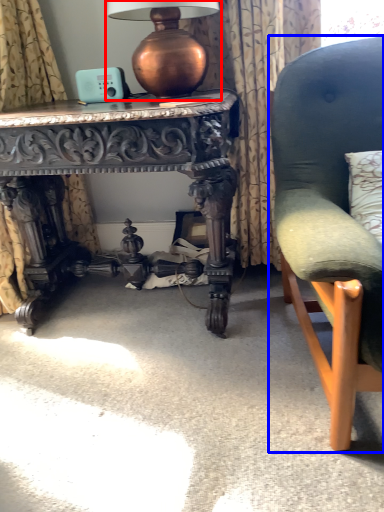
Question: Which object appears farthest to the camera in this image, table lamp (highlighted by a red box) or chair (highlighted by a blue box)?

Choices:
 (A) table lamp
 (B) chair

Answer: (A)